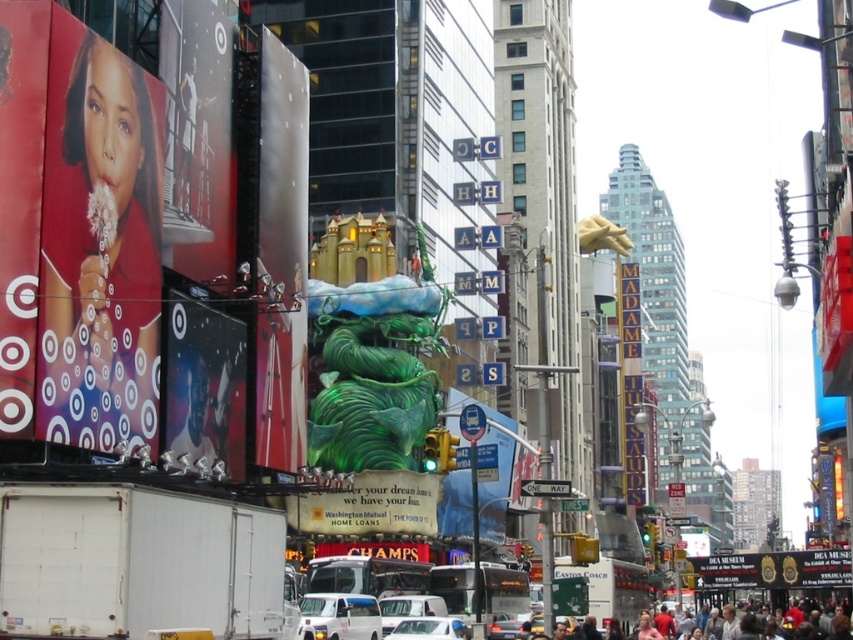
Does matte red dress at left appear over white matte car at center?

Indeed, matte red dress at left is positioned over white matte car at center.

Can you confirm if matte red dress at left is wider than white matte car at center?

No, matte red dress at left is not wider than white matte car at center.

Between point (128, 301) and point (392, 605), which one is positioned in front?

Point (128, 301) is in front.

Image resolution: width=853 pixels, height=640 pixels. Find the location of `matte red dress at left`. matte red dress at left is located at coordinates (99, 250).

Can you confirm if blue glossy bus stop sign at center is taller than white matte car at center?

Indeed, blue glossy bus stop sign at center has a greater height compared to white matte car at center.

Is blue glossy bus stop sign at center above white matte car at center?

Indeed, blue glossy bus stop sign at center is positioned over white matte car at center.

Where is `blue glossy bus stop sign at center`? The height and width of the screenshot is (640, 853). blue glossy bus stop sign at center is located at coordinates (495, 484).

Who is positioned more to the right, matte red dress at left or blue glossy bus stop sign at center?

blue glossy bus stop sign at center

Between point (154, 292) and point (502, 492), which one is positioned behind?

Positioned behind is point (502, 492).

Between point (86, 349) and point (456, 390), which one is positioned in front?

Point (86, 349)

This screenshot has width=853, height=640. I want to click on matte red dress at left, so click(99, 250).